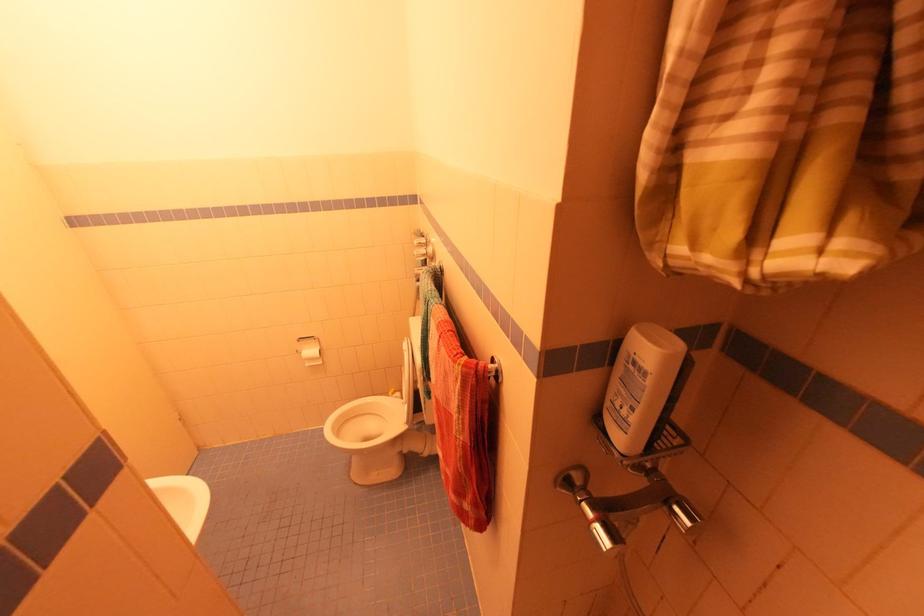
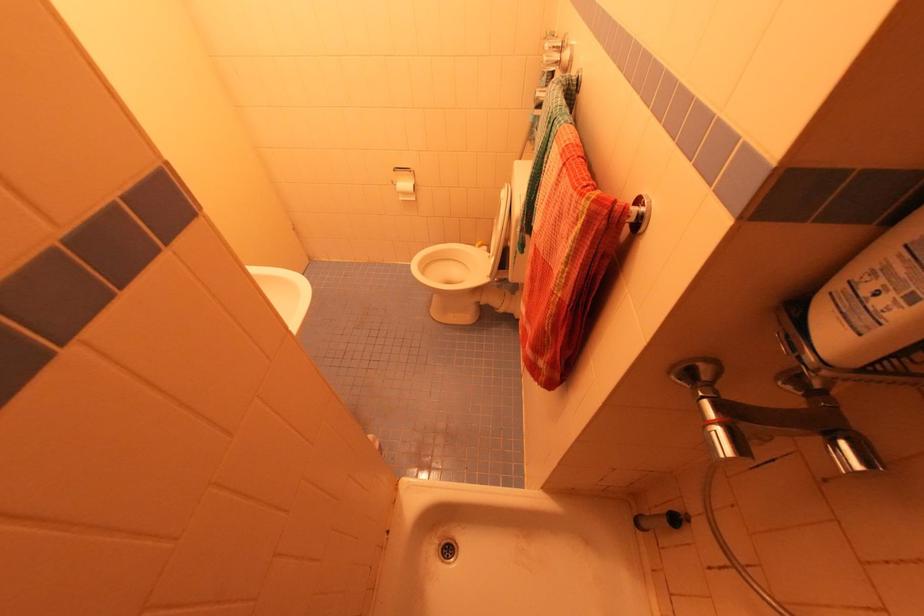
What movement of the cameraman would produce the second image?

The movement direction of the cameraman is left, forward.